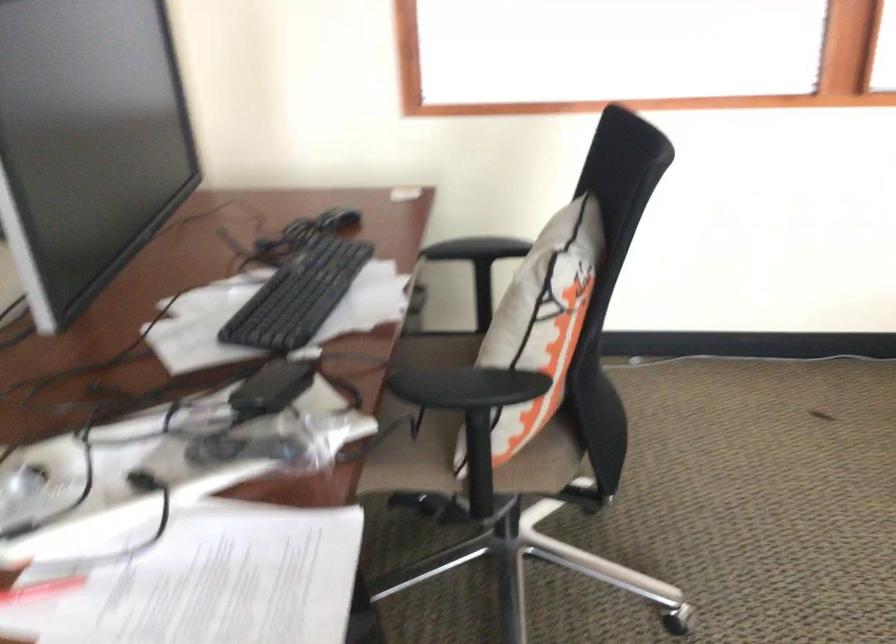
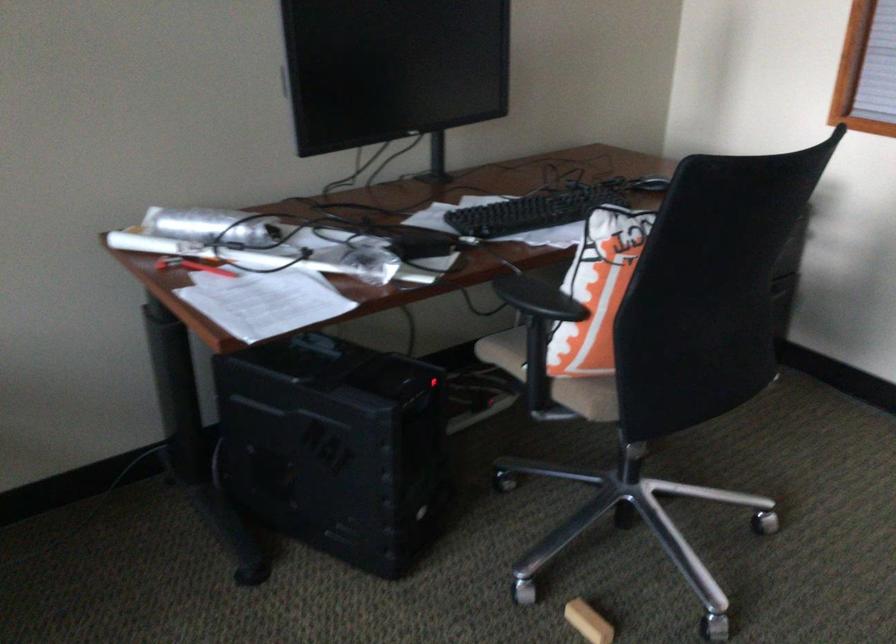
In the second image, find the point that corresponds to pixel 494 468 in the first image.

(552, 377)